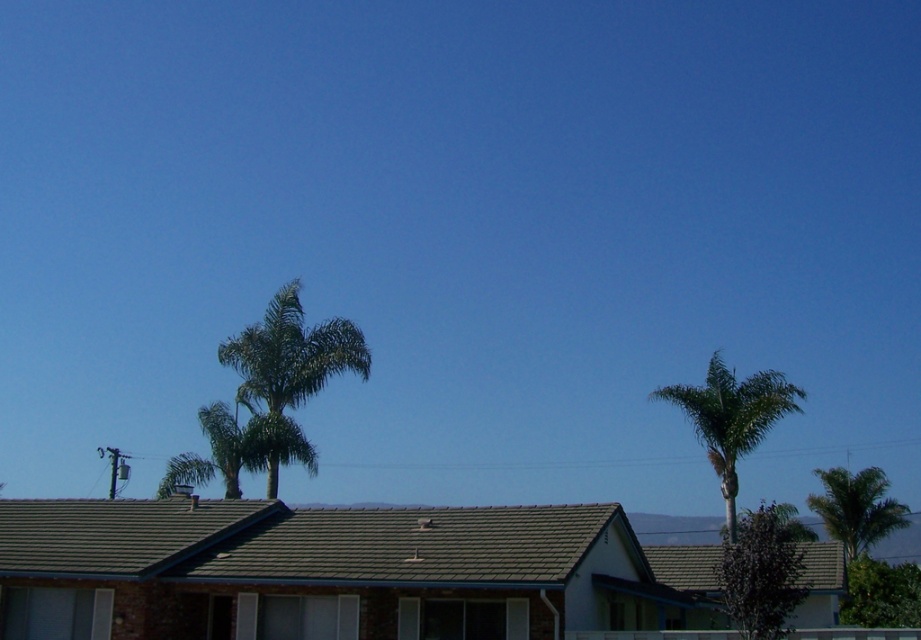
You are standing in the middle of the scene and want to find the tallest tree to rest under. Which tree should you choose between the green leafy tree at center and the green leafy palm tree at right?

The green leafy tree at center has a larger size compared to the green leafy palm tree at right, so it is taller and would be the better choice to rest under.

You are standing in the middle of a sunny park and want to find shade. You see a green leafy tree at center and a green leafy palm tree at right. Which tree should you go to for more shade?

The green leafy tree at center is taller than the green leafy palm tree at right, so it likely provides more shade.

You are standing in the middle of a sunny garden and see two palm trees, the green leafy palm tree at center and the green leafy palm tree at upper right. Which one is taller?

The green leafy palm tree at upper right is taller than the green leafy palm tree at center.